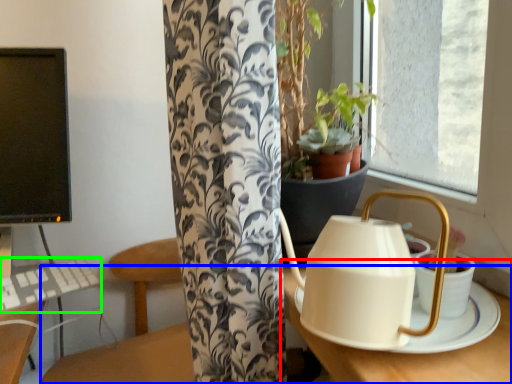
Question: Which is nearer to the round table (highlighted by a red box)? table (highlighted by a blue box) or keyboard (highlighted by a green box).

Choices:
 (A) table
 (B) keyboard

Answer: (A)